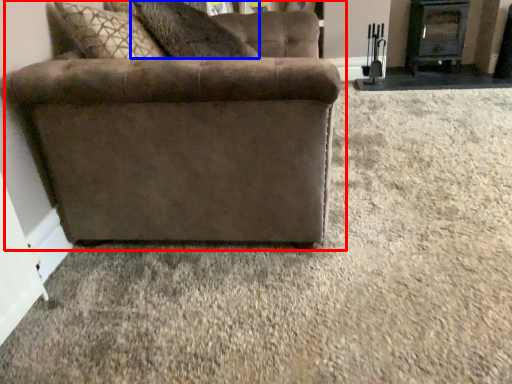
Question: Which object appears farthest to the camera in this image, studio couch (highlighted by a red box) or pillow (highlighted by a blue box)?

Choices:
 (A) studio couch
 (B) pillow

Answer: (B)